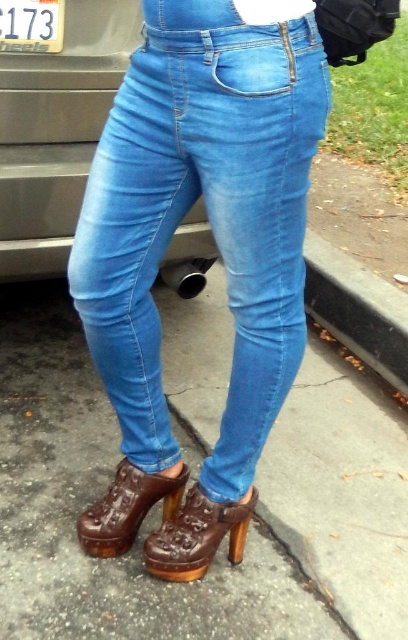
You are a photographer standing 2 feet away from the denim jeans at center. Can you capture the entire jeans in one shot without moving closer or farther?

The denim jeans at center are 23.68 inches away from the viewer. Since you are standing 2 feet away, which is 24 inches, you are slightly farther than the jeans. To capture the entire jeans in one shot without moving, you would need a wide enough lens or adjust your position slightly closer.

You are a fashion designer trying to create a matching outfit. You have to decide which item to place first in the design process based on their size. Since the denim jeans at center is larger in size than brown leather boot at lower center, which item should you start designing first?

Since the denim jeans at center is larger in size than the brown leather boot at lower center, you should start designing the denim jeans at center first because larger items typically require more detailed planning and adjustments in the design process.